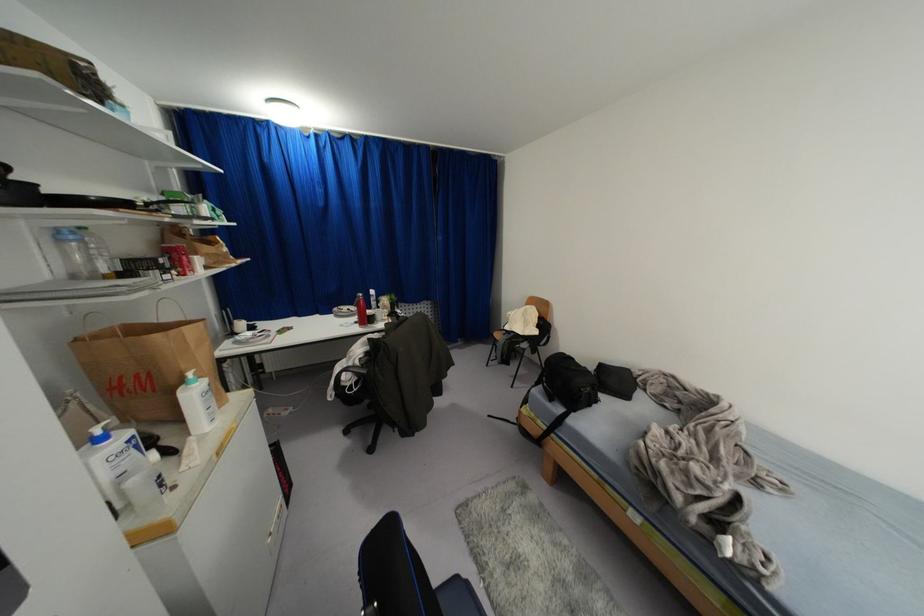
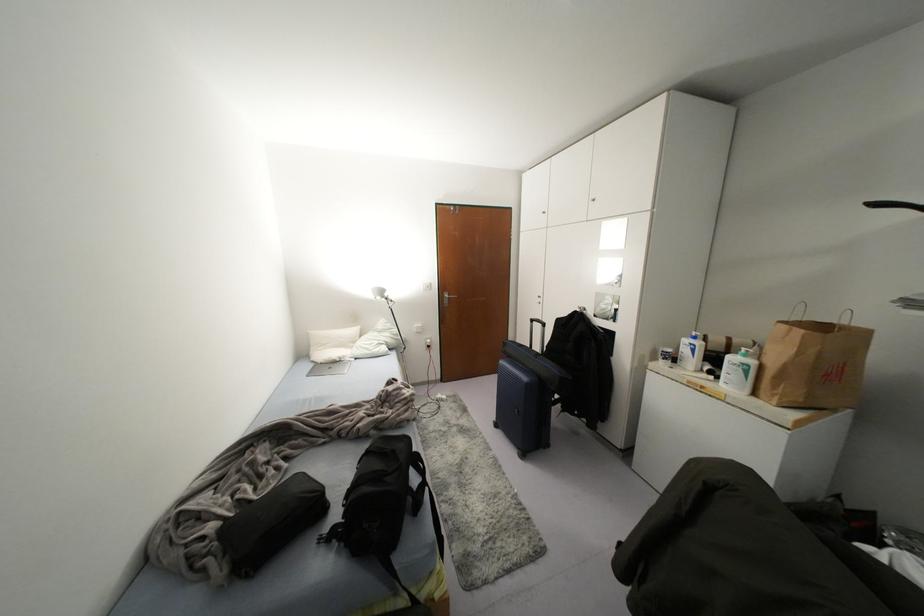
In the second image, find the point that corresponds to the point at 137,446 in the first image.

(691, 350)